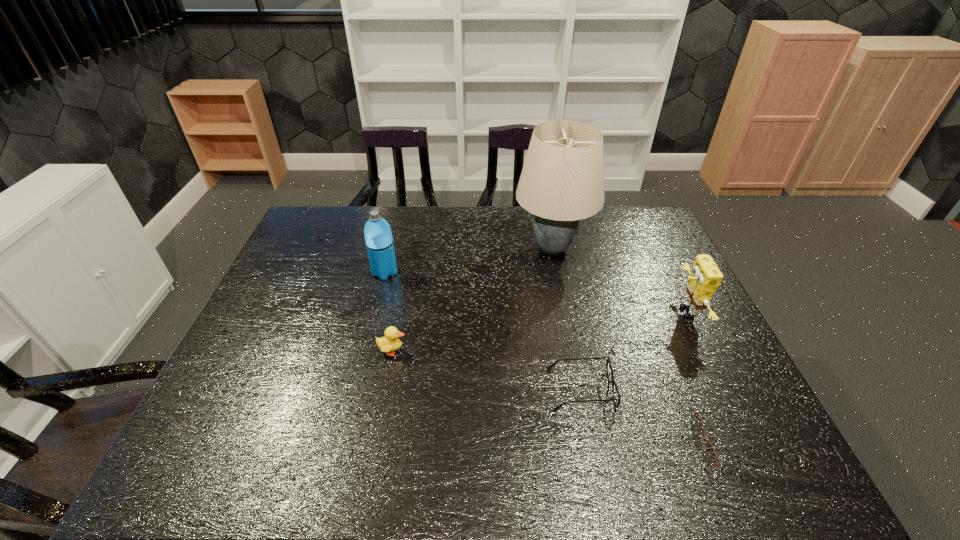
This screenshot has height=540, width=960. What are the coordinates of `vacant space located 0.300m on the face of the nearest object` in the screenshot? It's located at (564, 442).

You are a GUI agent. You are given a task and a screenshot of the screen. Output one action in this format:
    pyautogui.click(x=<x>, y=<y>)
    Task: Click on the vacant space situated 0.170m on the face of the nearest object
    The height and width of the screenshot is (540, 960).
    Given the screenshot: What is the action you would take?
    pyautogui.click(x=623, y=442)

Identify the location of object that is at the far edge. (562, 181).

Find the location of a particular element. The image size is (960, 540). object present at the near edge is located at coordinates (698, 422).

Locate an element on the screen. This screenshot has width=960, height=540. sponge located at the right edge is located at coordinates (705, 278).

Image resolution: width=960 pixels, height=540 pixels. Identify the location of sunglasses that is at the right edge. (698, 422).

You are a GUI agent. You are given a task and a screenshot of the screen. Output one action in this format:
    pyautogui.click(x=<x>, y=<y>)
    Task: Click on the object that is at the near right corner
    Image resolution: width=960 pixels, height=540 pixels.
    Given the screenshot: What is the action you would take?
    pyautogui.click(x=698, y=422)

This screenshot has height=540, width=960. In order to click on vacant region at the far edge of the desktop in this screenshot , I will do `click(504, 207)`.

In the image, there is a desktop. Where is `vacant space at the left edge`? Image resolution: width=960 pixels, height=540 pixels. vacant space at the left edge is located at coordinates (240, 341).

Identify the location of vacant space at the right edge. The image size is (960, 540). (648, 300).